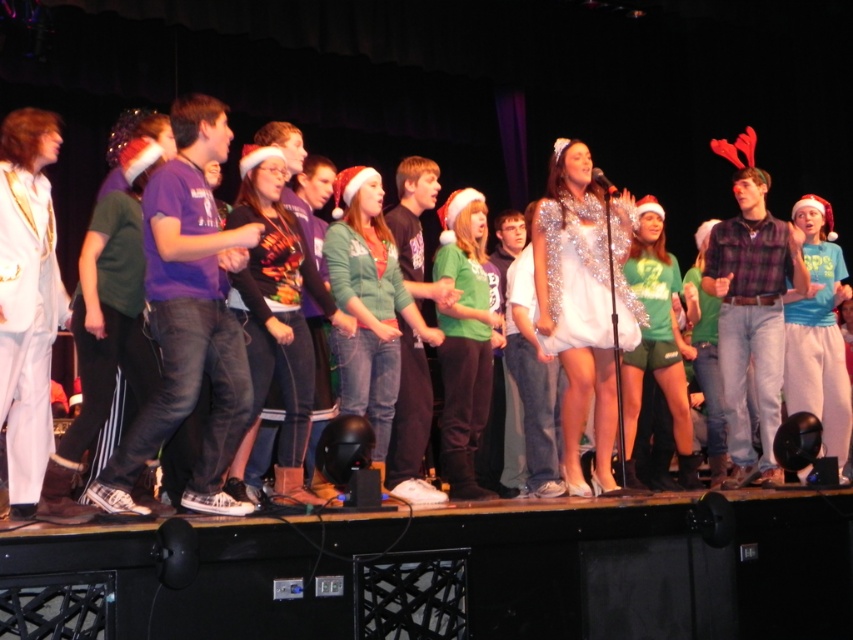
You are an audience member sitting in the front row of the stage. You see two points marked on the stage floor. The first point is at coordinate point (404, 152) and the second point is at coordinate point (16, 116). From your perspective, which point is closer to you?

Point (16, 116) is closer to you because it is in front of point (404, 152), which is behind it.

You are a photographer positioned at the back of the stage. You need to capture a clear photo of both the shiny silver dress at center and the white leather boots at left. Which object will appear larger in your photo?

The shiny silver dress at center will appear larger in the photo because it is closer to the photographer than the white leather boots at left, making it take up more space in the frame.